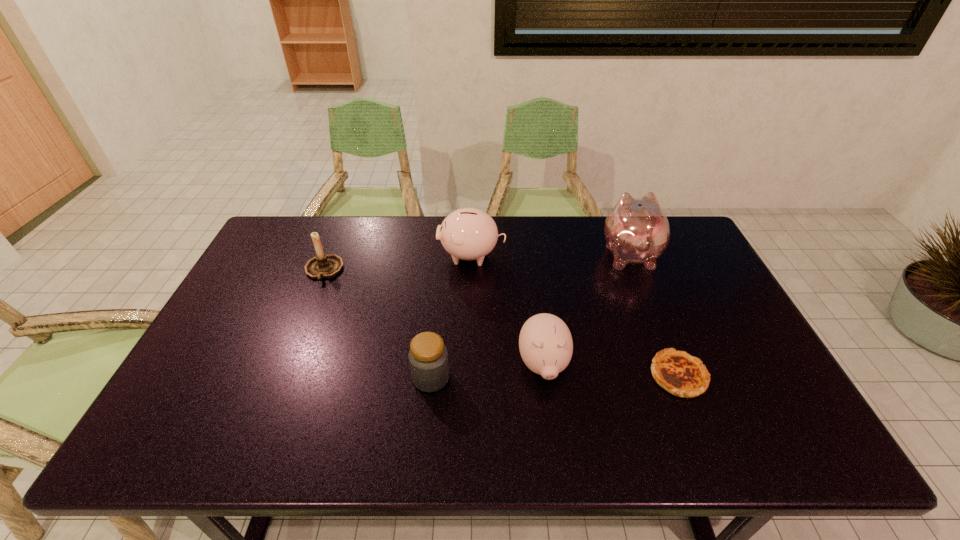
Locate an element on the screen. This screenshot has width=960, height=540. free region at the near edge of the desktop is located at coordinates (332, 454).

I want to click on vacant space at the left edge of the desktop, so click(x=207, y=410).

At what (x,y) coordinates should I click in order to perform the action: click on vacant region at the right edge. Please return your answer as a coordinate pair (x, y). The image size is (960, 540). Looking at the image, I should click on (758, 401).

Identify the location of vacant space at the near left corner of the desktop. The image size is (960, 540). (191, 424).

In the image, there is a desktop. Identify the location of vacant space at the near right corner. (782, 431).

You are a GUI agent. You are given a task and a screenshot of the screen. Output one action in this format:
    pyautogui.click(x=<x>, y=<y>)
    Task: Click on the free area in between the rightmost piggy bank and the leftmost object
    The width and height of the screenshot is (960, 540).
    Given the screenshot: What is the action you would take?
    pyautogui.click(x=476, y=262)

Where is `empty space between the candle holder and the quiche`? empty space between the candle holder and the quiche is located at coordinates (501, 323).

The height and width of the screenshot is (540, 960). In order to click on vacant space in between the leftmost piggy bank and the candle holder in this screenshot , I will do `click(397, 263)`.

You are a GUI agent. You are given a task and a screenshot of the screen. Output one action in this format:
    pyautogui.click(x=<x>, y=<y>)
    Task: Click on the vacant space that is in between the quiche and the leftmost object
    This screenshot has width=960, height=540.
    Given the screenshot: What is the action you would take?
    pyautogui.click(x=501, y=323)

Locate an element on the screen. This screenshot has width=960, height=540. vacant area that lies between the quiche and the tallest object is located at coordinates (654, 315).